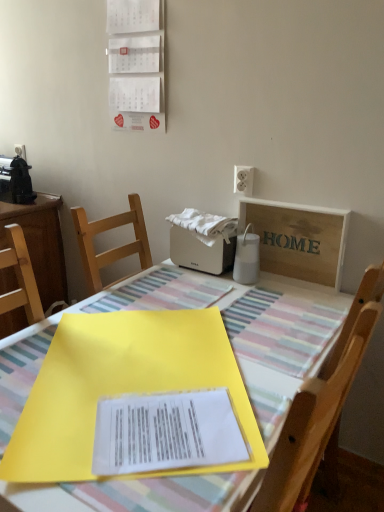
In order to face wooden sign at upper right, should I rotate leftwards or rightwards?

You should rotate right by 12.919 degrees.

Describe the element at coordinates (142, 494) in the screenshot. I see `yellow plastic folder at center` at that location.

How much space does black plastic toaster at left, which is the second appliance from bottom to top, occupy horizontally?

The width of black plastic toaster at left, which is the second appliance from bottom to top, is 13.52 inches.

Measure the distance between point (0, 167) and camera.

The depth of point (0, 167) is 7.07 feet.

Describe the element at coordinates (201, 251) in the screenshot. I see `white plastic toaster at center, the 2th appliance in the top-to-bottom sequence` at that location.

Image resolution: width=384 pixels, height=512 pixels. What are the coordinates of `wooden sign at upper right` in the screenshot? It's located at (298, 239).

Is white paper calendar at upper center in front of or behind black plastic toaster at left, the 2th appliance from the right, in the image?

In the image, white paper calendar at upper center appears in front of black plastic toaster at left, the 2th appliance from the right.

Considering the sizes of white paper calendar at upper center and black plastic toaster at left, which appears as the 1th appliance when viewed from the left, in the image, is white paper calendar at upper center bigger or smaller than black plastic toaster at left, which appears as the 1th appliance when viewed from the left,?

Considering their sizes, white paper calendar at upper center takes up less space than black plastic toaster at left, which appears as the 1th appliance when viewed from the left.

Locate an element on the screen. The image size is (384, 512). bulletin board that appears above the black plastic toaster at left, the 2th appliance from the right (from the image's perspective) is located at coordinates (136, 64).

From the picture: Which is farther from the camera, (x=244, y=205) or (x=226, y=229)?

The point (x=244, y=205) is more distant.

Between wooden sign at upper right and white cotton towel at center, which one has larger size?

wooden sign at upper right is bigger.

Locate an element on the screen. cardboard box in front of the white cotton towel at center is located at coordinates (298, 239).

Which object is wider, wooden sign at upper right or white cotton towel at center?

white cotton towel at center.

Is yellow plastic folder at center taller than wooden sign at upper right?

Indeed, yellow plastic folder at center has a greater height compared to wooden sign at upper right.

Could you tell me if yellow plastic folder at center is facing wooden sign at upper right?

No, yellow plastic folder at center is not oriented towards wooden sign at upper right.

Is yellow plastic folder at center thinner than wooden sign at upper right?

No, yellow plastic folder at center is not thinner than wooden sign at upper right.

From the image's perspective, which one is positioned higher, yellow plastic folder at center or wooden sign at upper right?

wooden sign at upper right, from the image's perspective.

Relative to white plastic toaster at center, arranged as the 2th appliance when viewed from the left, is white paper calendar at upper center in front or behind?

Visually, white paper calendar at upper center is located in front of white plastic toaster at center, arranged as the 2th appliance when viewed from the left.

Considering the sizes of white paper calendar at upper center and white plastic toaster at center, the 1th appliance from the front, in the image, is white paper calendar at upper center wider or thinner than white plastic toaster at center, the 1th appliance from the front,?

Clearly, white paper calendar at upper center has less width compared to white plastic toaster at center, the 1th appliance from the front.

Would you say white plastic toaster at center, which ranks as the second appliance in back-to-front order, is part of white paper calendar at upper center's contents?

Actually, white plastic toaster at center, which ranks as the second appliance in back-to-front order, is outside white paper calendar at upper center.

Which is more to the right, white paper calendar at upper center or white plastic toaster at center, the 1th appliance from the front?

white plastic toaster at center, the 1th appliance from the front.

Considering the positions of point (201, 234) and point (164, 130), is point (201, 234) closer or farther from the camera than point (164, 130)?

Point (201, 234).

Is white cotton towel at center located outside white paper calendar at upper center?

white cotton towel at center lies outside white paper calendar at upper center's area.

The image size is (384, 512). What are the coordinates of `fabric in front of the white paper calendar at upper center` in the screenshot? It's located at (205, 225).

From a real-world perspective, is white cotton towel at center located beneath white paper calendar at upper center?

Yes, from a real-world perspective, white cotton towel at center is under white paper calendar at upper center.

Which of these two, wooden chair at center or yellow plastic folder at center, stands shorter?

yellow plastic folder at center is shorter.

From a real-world perspective, which is physically below, wooden chair at center or yellow plastic folder at center?

From a 3D spatial view, yellow plastic folder at center is below.

Identify the location of table in front of the wooden chair at center. The width and height of the screenshot is (384, 512). (142, 494).

Relative to yellow plastic folder at center, is wooden chair at center in front or behind?

In the image, wooden chair at center appears behind yellow plastic folder at center.

Consider the image. Between white cotton towel at center and white plastic toaster at center, marked as the first appliance in a bottom-to-top arrangement, which one has larger size?

With larger size is white plastic toaster at center, marked as the first appliance in a bottom-to-top arrangement.

Which is behind, point (196, 228) or point (185, 234)?

The point (185, 234) is farther.

In the scene shown: Are white cotton towel at center and white plastic toaster at center, marked as the first appliance in a bottom-to-top arrangement, located far from each other?

No, there isn't a large distance between white cotton towel at center and white plastic toaster at center, marked as the first appliance in a bottom-to-top arrangement.

This screenshot has height=512, width=384. Find the location of `bulletin board that is in front of the black plastic toaster at left, the 2th appliance from the right`. bulletin board that is in front of the black plastic toaster at left, the 2th appliance from the right is located at coordinates (136, 64).

I want to click on fabric lying behind the wooden sign at upper right, so click(x=205, y=225).

Which object lies nearer to the anchor point yellow paper at center, black plastic toaster at left, which is the second appliance from bottom to top, or white paper calendar at upper center?

white paper calendar at upper center lies closer to yellow paper at center than the other object.

When comparing their distances from yellow paper at center, does yellow plastic folder at center or black plastic toaster at left, which is the second appliance from bottom to top, seem closer?

yellow plastic folder at center lies closer to yellow paper at center than the other object.

Considering their positions, is white paper calendar at upper center positioned further to yellow paper at center than white plastic toaster at center, which ranks as the second appliance in back-to-front order?

Among the two, white paper calendar at upper center is located further to yellow paper at center.

Looking at the image, which one is located closer to yellow plastic folder at center, wooden chair at center or wooden sign at upper right?

Based on the image, wooden sign at upper right appears to be nearer to yellow plastic folder at center.

Looking at the image, which one is located closer to wooden chair at center, white paper calendar at upper center or white cotton towel at center?

white cotton towel at center.

Estimate the real-world distances between objects in this image. Which object is closer to yellow plastic folder at center, wooden sign at upper right or white cotton towel at center?

The object closer to yellow plastic folder at center is wooden sign at upper right.

Based on their spatial positions, is white cotton towel at center or yellow paper at center further from white plastic toaster at center, arranged as the 2th appliance when viewed from the left?

yellow paper at center is positioned further to the anchor white plastic toaster at center, arranged as the 2th appliance when viewed from the left.

Based on their spatial positions, is yellow paper at center or black plastic toaster at left, which is the second appliance from bottom to top, closer to white cotton towel at center?

Among the two, yellow paper at center is located nearer to white cotton towel at center.

Where is `chair between black plastic toaster at left, which is the second appliance from bottom to top, and wooden sign at upper right, in the horizontal direction`? This screenshot has height=512, width=384. chair between black plastic toaster at left, which is the second appliance from bottom to top, and wooden sign at upper right, in the horizontal direction is located at coordinates (312, 425).

I want to click on chair between yellow plastic folder at center and black plastic toaster at left, positioned as the first appliance in top-to-bottom order, from front to back, so click(x=312, y=425).

You are a GUI agent. You are given a task and a screenshot of the screen. Output one action in this format:
    pyautogui.click(x=<x>, y=<y>)
    Task: Click on the fabric between white paper calendar at upper center and wooden sign at upper right in the up-down direction
    The image size is (384, 512).
    Given the screenshot: What is the action you would take?
    point(205,225)

Find the location of a particular element. fabric positioned between yellow paper at center and white plastic toaster at center, the 1th appliance from the front, from near to far is located at coordinates (205, 225).